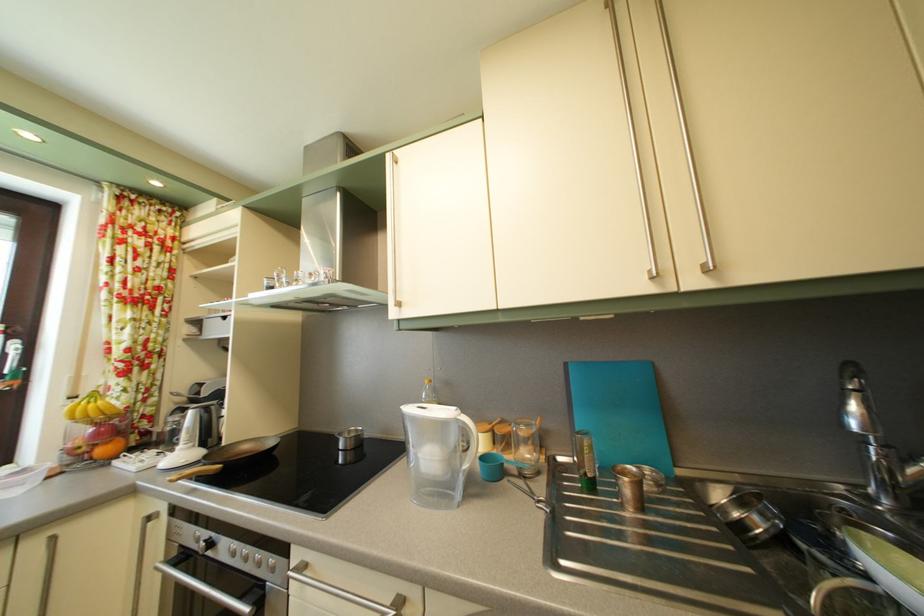
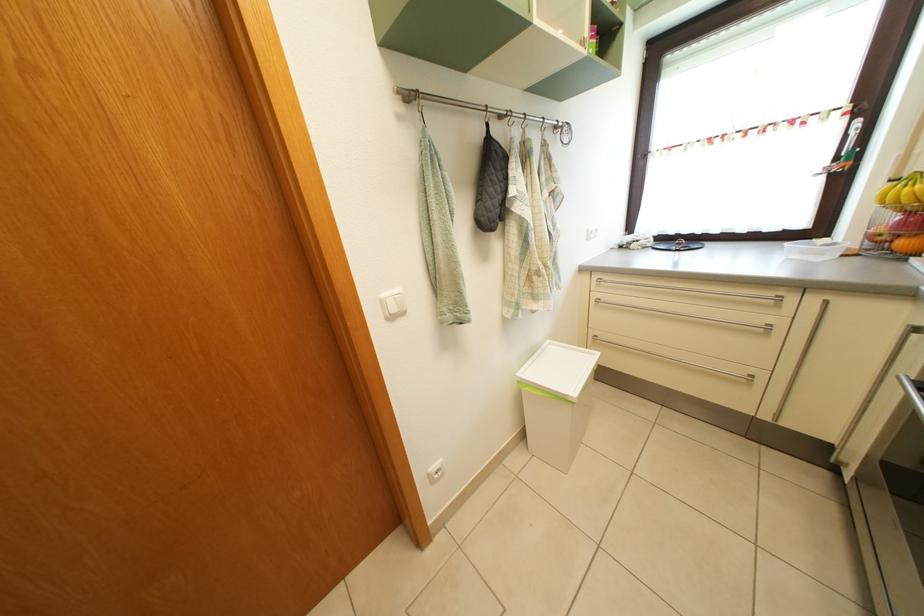
Locate, in the second image, the point that corresponds to (x=111, y=458) in the first image.

(910, 252)